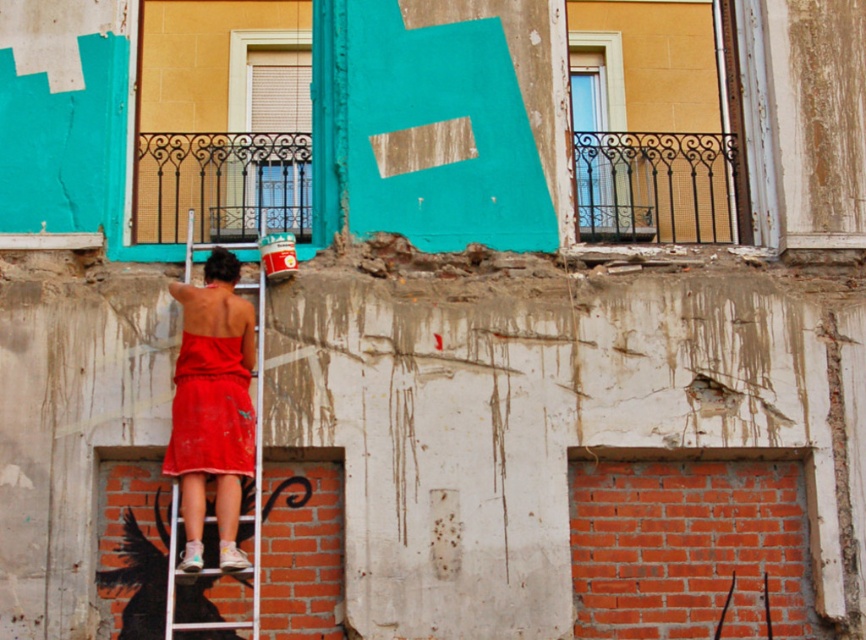
You are a painter who needs to reach the teal matte letter at center. You see the white metallic ladder at center. Can you use the ladder to reach the letter?

The white metallic ladder at center is behind the teal matte letter at center, so the ladder cannot be used to reach the letter because it is positioned behind it.

You are a painter who needs to place a teal matte letter at center on the wall. You are currently standing on the white metallic ladder at center. Which direction should you move to position the letter correctly?

The teal matte letter at center is to the right of the white metallic ladder at center, so you should move to the right to position the letter correctly.

You are a painter who needs to reach the teal matte letter at center on the wall. Given that your ladder can extend up to 60 feet, will you be able to reach it?

The teal matte letter at center is 63.59 feet away from the camera, which is beyond the ladder extension limit of 60 feet. Therefore, you cannot reach it with the current ladder.